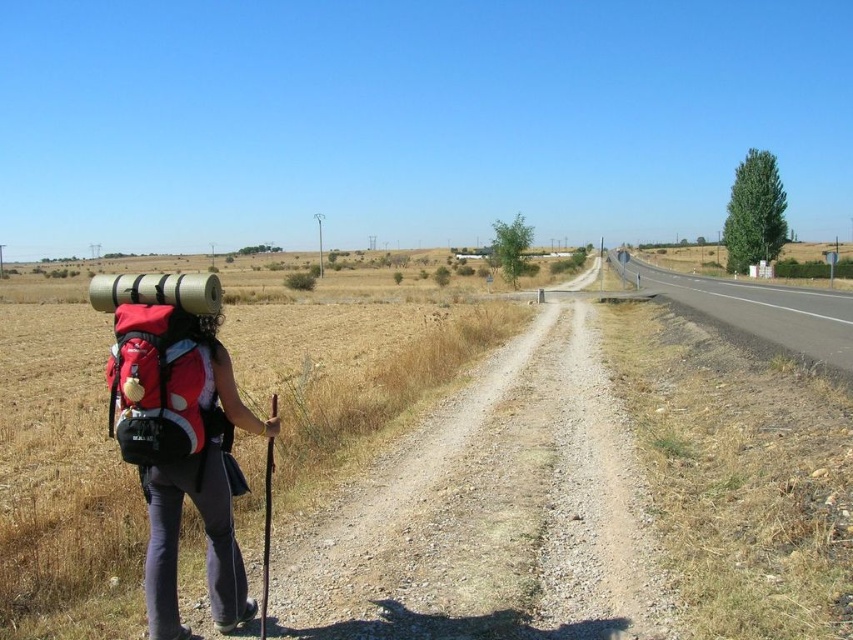
You are a hiker trying to decide whether to follow the path or the road. You notice the matte red backpack at left and the asphalt road at right in the scene. Which direction should you go if you want to stay on the unpaved path with the dry grass?

You should stay on the path to the left of the asphalt road at right, where the matte red backpack at left is located, as that is the unpaved path with dry grass described in the scene.